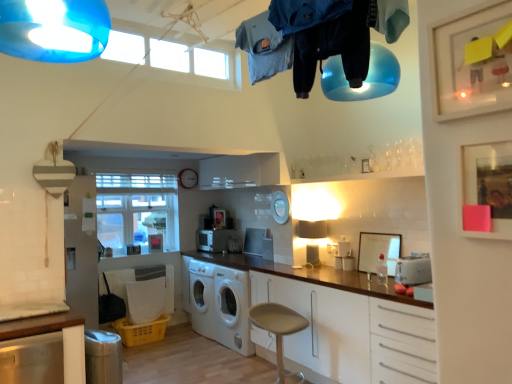
Identify the location of metallic silver toaster at center, the 2th appliance from the left. (254, 241).

Where is `white matte washing machine at center`? This screenshot has width=512, height=384. white matte washing machine at center is located at coordinates (219, 303).

Identify the location of dark blue fabric pants at upper center, acting as the second clothing starting from the back. (333, 48).

Measure the distance between point (348,325) and camera.

Point (348,325) is 3.10 meters from camera.

What do you see at coordinates (378, 251) in the screenshot? I see `white matte picture frame at right, which is counted as the second picture frame, starting from the front` at bounding box center [378, 251].

This screenshot has height=384, width=512. What do you see at coordinates (137, 211) in the screenshot?
I see `clear glass window at center` at bounding box center [137, 211].

What do you see at coordinates (488, 185) in the screenshot? The width and height of the screenshot is (512, 384). I see `matte pink paper at upper right, the second picture frame in the right-to-left sequence` at bounding box center [488, 185].

What do you see at coordinates (215, 239) in the screenshot? I see `white matte microwave at center, the 1th appliance in the back-to-front sequence` at bounding box center [215, 239].

The image size is (512, 384). I want to click on metallic silver toaster at center, the second appliance viewed from the front, so click(x=254, y=241).

How much distance is there between white plastic toaster at right, which is the 3th appliance in back-to-front order, and dark blue fabric pants at upper center, which ranks as the 2th clothing in front-to-back order?

They are 5.26 feet apart.

Who is bigger, white plastic toaster at right, the first appliance in the front-to-back sequence, or dark blue fabric pants at upper center, acting as the second clothing starting from the back?

dark blue fabric pants at upper center, acting as the second clothing starting from the back.

Is point (408, 283) closer or farther from the camera than point (361, 65)?

Point (408, 283).

From the image's perspective, which appliance is the 2nd one below the dark blue fabric pants at upper center, which ranks as the 2th clothing in front-to-back order? Please provide its 2D coordinates.

[(413, 270)]

Considering the sizes of denim shirt at upper center, which ranks as the 1th clothing in back-to-front order, and white matte picture frame at right, which is counted as the second picture frame, starting from the front, in the image, is denim shirt at upper center, which ranks as the 1th clothing in back-to-front order, taller or shorter than white matte picture frame at right, which is counted as the second picture frame, starting from the front,?

In the image, denim shirt at upper center, which ranks as the 1th clothing in back-to-front order, appears to be taller than white matte picture frame at right, which is counted as the second picture frame, starting from the front.

How many degrees apart are the facing directions of denim shirt at upper center, which ranks as the 1th clothing in back-to-front order, and white matte picture frame at right, the 2th picture frame in the top-to-bottom sequence?

There is a 10.9-degree angle between the facing directions of denim shirt at upper center, which ranks as the 1th clothing in back-to-front order, and white matte picture frame at right, the 2th picture frame in the top-to-bottom sequence.

Is denim shirt at upper center, which ranks as the 1th clothing in back-to-front order, at the right side of white matte picture frame at right, the 2th picture frame in the top-to-bottom sequence?

Incorrect, denim shirt at upper center, which ranks as the 1th clothing in back-to-front order, is not on the right side of white matte picture frame at right, the 2th picture frame in the top-to-bottom sequence.

Considering the positions of points (254, 28) and (365, 252), is point (254, 28) farther from camera compared to point (365, 252)?

No.

Is metallic silver toaster at center, marked as the 2th appliance in a right-to-left arrangement, far from matte pink paper at upper right, the 2th picture frame positioned from the bottom?

Yes, metallic silver toaster at center, marked as the 2th appliance in a right-to-left arrangement, and matte pink paper at upper right, the 2th picture frame positioned from the bottom, are quite far apart.

Locate an element on the screen. the 2nd appliance behind when counting from the matte pink paper at upper right, which appears as the 1th picture frame when viewed from the top is located at coordinates point(254,241).

Could matte pink paper at upper right, the second picture frame in the right-to-left sequence, be considered to be inside metallic silver toaster at center, which ranks as the 2th appliance in back-to-front order?

That's incorrect, matte pink paper at upper right, the second picture frame in the right-to-left sequence, is not inside metallic silver toaster at center, which ranks as the 2th appliance in back-to-front order.

From the image's perspective, is white matte microwave at center, the 1th appliance in the back-to-front sequence, located beneath clear glass window at center?

Correct, white matte microwave at center, the 1th appliance in the back-to-front sequence, appears lower than clear glass window at center in the image.

Which of these two, white matte microwave at center, the third appliance when ordered from front to back, or clear glass window at center, is thinner?

With smaller width is clear glass window at center.

Considering the positions of points (213, 230) and (121, 250), is point (213, 230) closer to camera compared to point (121, 250)?

Yes, point (213, 230) is closer to viewer.

At what (x,y) coordinates should I click in order to perform the action: click on appliance behind the clear glass window at center. Please return your answer as a coordinate pair (x, y). Looking at the image, I should click on (215, 239).

Does blue cotton hoodie at upper center, the 1th clothing in the front-to-back sequence, lie behind matte pink paper at upper right, the second picture frame in the back-to-front sequence?

Yes, blue cotton hoodie at upper center, the 1th clothing in the front-to-back sequence, is further from the viewer.

Is blue cotton hoodie at upper center, the 1th clothing in the front-to-back sequence, spatially inside matte pink paper at upper right, marked as the first picture frame in a left-to-right arrangement, or outside of it?

blue cotton hoodie at upper center, the 1th clothing in the front-to-back sequence, cannot be found inside matte pink paper at upper right, marked as the first picture frame in a left-to-right arrangement.

What's the angular difference between blue cotton hoodie at upper center, acting as the third clothing starting from the back, and matte pink paper at upper right, the second picture frame in the back-to-front sequence,'s facing directions?

blue cotton hoodie at upper center, acting as the third clothing starting from the back, and matte pink paper at upper right, the second picture frame in the back-to-front sequence, are facing 4.89 degrees away from each other.

Identify the location of picture frame in front of the blue cotton hoodie at upper center, acting as the third clothing starting from the back. (488, 185).

In the scene shown: Is dark blue fabric pants at upper center, which ranks as the 2th clothing in front-to-back order, wider or thinner than white matte cabinet at center?

Clearly, dark blue fabric pants at upper center, which ranks as the 2th clothing in front-to-back order, has less width compared to white matte cabinet at center.

From a real-world perspective, who is located higher, dark blue fabric pants at upper center, acting as the second clothing starting from the back, or white matte cabinet at center?

dark blue fabric pants at upper center, acting as the second clothing starting from the back, from a real-world perspective.

Is dark blue fabric pants at upper center, acting as the second clothing starting from the back, far away from white matte cabinet at center?

Yes.

Looking at this image, considering the relative positions of dark blue fabric pants at upper center, which ranks as the 2th clothing in front-to-back order, and white matte cabinet at center in the image provided, is dark blue fabric pants at upper center, which ranks as the 2th clothing in front-to-back order, to the left or to the right of white matte cabinet at center?

In the image, dark blue fabric pants at upper center, which ranks as the 2th clothing in front-to-back order, appears on the left side of white matte cabinet at center.

Can you confirm if white matte washing machine at center is shorter than white matte picture frame at right, which is the 2th picture frame from left to right?

No, white matte washing machine at center is not shorter than white matte picture frame at right, which is the 2th picture frame from left to right.

Is white matte washing machine at center positioned before white matte picture frame at right, the 2th picture frame in the top-to-bottom sequence?

No, white matte washing machine at center is behind white matte picture frame at right, the 2th picture frame in the top-to-bottom sequence.

Considering the relative positions of white matte washing machine at center and white matte picture frame at right, the 2th picture frame in the top-to-bottom sequence, in the image provided, is white matte washing machine at center to the right of white matte picture frame at right, the 2th picture frame in the top-to-bottom sequence, from the viewer's perspective?

No, white matte washing machine at center is not to the right of white matte picture frame at right, the 2th picture frame in the top-to-bottom sequence.

Locate an element on the screen. Image resolution: width=512 pixels, height=384 pixels. the 1st appliance behind the dark blue fabric pants at upper center, acting as the second clothing starting from the back is located at coordinates (413, 270).

The image size is (512, 384). There is a white matte picture frame at right, positioned as the first picture frame in back-to-front order. What are the coordinates of `the 2nd clothing above it (from the image's perspective)` in the screenshot? It's located at (264, 47).

From the picture: Considering their positions, is metallic silver toaster at center, marked as the 2th appliance in a right-to-left arrangement, positioned closer to denim shirt at upper center, positioned as the third clothing in front-to-back order, than beige fabric stool at lower center?

Among the two, beige fabric stool at lower center is located nearer to denim shirt at upper center, positioned as the third clothing in front-to-back order.

Which object lies further to the anchor point matte pink paper at upper right, marked as the first picture frame in a left-to-right arrangement, blue cotton hoodie at upper center, the 1th clothing in the front-to-back sequence, or dark blue fabric pants at upper center, which ranks as the 2th clothing in front-to-back order?

blue cotton hoodie at upper center, the 1th clothing in the front-to-back sequence.

Based on the photo, which object lies nearer to the anchor point blue cotton hoodie at upper center, the 1th clothing in the front-to-back sequence, white matte washing machine at center or metallic silver toaster at center, which ranks as the 2th appliance in back-to-front order?

The object closer to blue cotton hoodie at upper center, the 1th clothing in the front-to-back sequence, is metallic silver toaster at center, which ranks as the 2th appliance in back-to-front order.

Which object lies further to the anchor point dark blue fabric pants at upper center, acting as the second clothing starting from the back, denim shirt at upper center, positioned as the third clothing in front-to-back order, or white matte microwave at center, the third appliance when ordered from front to back?

white matte microwave at center, the third appliance when ordered from front to back, is further to dark blue fabric pants at upper center, acting as the second clothing starting from the back.

When comparing their distances from blue cotton hoodie at upper center, acting as the third clothing starting from the back, does beige fabric stool at lower center or metallic silver toaster at center, the 2th appliance from the left, seem further?

metallic silver toaster at center, the 2th appliance from the left.

When comparing their distances from blue cotton hoodie at upper center, acting as the third clothing starting from the back, does white matte picture frame at right, the 2th picture frame in the top-to-bottom sequence, or white matte washing machine at center seem closer?

Based on the image, white matte picture frame at right, the 2th picture frame in the top-to-bottom sequence, appears to be nearer to blue cotton hoodie at upper center, acting as the third clothing starting from the back.

When comparing their distances from white plastic toaster at right, placed as the third appliance when sorted from left to right, does clear glass window at center or blue cotton hoodie at upper center, the 1th clothing in the front-to-back sequence, seem closer?

blue cotton hoodie at upper center, the 1th clothing in the front-to-back sequence.

Estimate the real-world distances between objects in this image. Which object is further from white matte picture frame at right, positioned as the first picture frame in back-to-front order, white plastic toaster at right, which is the 3th appliance in back-to-front order, or white matte microwave at center, the third appliance when ordered from right to left?

Based on the image, white matte microwave at center, the third appliance when ordered from right to left, appears to be further to white matte picture frame at right, positioned as the first picture frame in back-to-front order.

At what (x,y) coordinates should I click in order to perform the action: click on clothing between denim shirt at upper center, which ranks as the 1th clothing in back-to-front order, and white matte cabinet at center vertically. Please return your answer as a coordinate pair (x, y). Looking at the image, I should click on (333, 48).

Identify the location of appliance positioned between blue cotton hoodie at upper center, acting as the third clothing starting from the back, and white matte washing machine at center from near to far. This screenshot has width=512, height=384. (413, 270).

The width and height of the screenshot is (512, 384). Find the location of `cabinetry located between denim shirt at upper center, positioned as the third clothing in front-to-back order, and white matte washing machine at center in the depth direction`. cabinetry located between denim shirt at upper center, positioned as the third clothing in front-to-back order, and white matte washing machine at center in the depth direction is located at coordinates (352, 334).

Where is `bar stool positioned between white matte cabinet at center and clear glass window at center from near to far`? This screenshot has height=384, width=512. bar stool positioned between white matte cabinet at center and clear glass window at center from near to far is located at coordinates (279, 331).